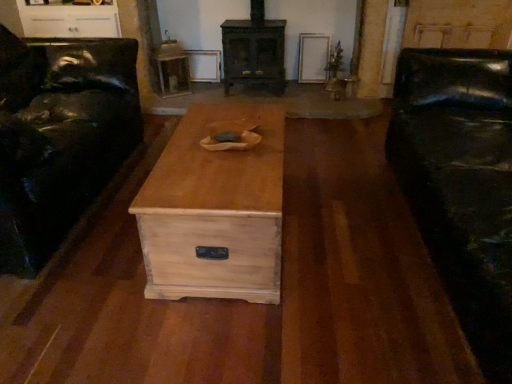
This screenshot has height=384, width=512. Describe the element at coordinates (215, 210) in the screenshot. I see `natural wood chest at center` at that location.

What do you see at coordinates (254, 51) in the screenshot?
I see `dark brown wood fireplace at center` at bounding box center [254, 51].

At what (x,y) coordinates should I click in order to perform the action: click on black leather couch at right. Please return your answer as a coordinate pair (x, y). This screenshot has width=512, height=384. Looking at the image, I should click on (461, 183).

Identify the location of natural wood chest at center. click(215, 210).

Between point (129, 58) and point (257, 211), which one is positioned behind?

Point (129, 58)

Which of these two, matte black leather couch at left or natural wood chest at center, is thinner?

natural wood chest at center.

In the image, is matte black leather couch at left positioned in front of or behind natural wood chest at center?

Visually, matte black leather couch at left is located in front of natural wood chest at center.

Between point (234, 42) and point (478, 69), which one is positioned behind?

Positioned behind is point (234, 42).

From the image's perspective, does dark brown wood fireplace at center appear higher than black leather couch at right?

Yes.

Can we say dark brown wood fireplace at center lies outside black leather couch at right?

Yes, dark brown wood fireplace at center is not within black leather couch at right.

Does dark brown wood fireplace at center come behind black leather couch at right?

Yes.

Who is bigger, wooden side table at upper center or natural wood chest at center?

natural wood chest at center is bigger.

Can you confirm if wooden side table at upper center is shorter than natural wood chest at center?

Incorrect, the height of wooden side table at upper center does not fall short of that of natural wood chest at center.

Would you say wooden side table at upper center is a long distance from natural wood chest at center?

wooden side table at upper center is far away from natural wood chest at center.

Which is more to the left, wooden side table at upper center or natural wood chest at center?

From the viewer's perspective, wooden side table at upper center appears more on the left side.

Considering the positions of objects wooden side table at upper center and dark brown wood fireplace at center in the image provided, who is more to the left, wooden side table at upper center or dark brown wood fireplace at center?

Positioned to the left is wooden side table at upper center.

Looking at this image, could you tell me if wooden side table at upper center is turned towards dark brown wood fireplace at center?

No.

At what (x,y) coordinates should I click in order to perform the action: click on side table on the left of dark brown wood fireplace at center. Please return your answer as a coordinate pair (x, y). The image size is (512, 384). Looking at the image, I should click on (172, 69).

From a real-world perspective, which is physically above, wooden side table at upper center or dark brown wood fireplace at center?

In real-world perspective, dark brown wood fireplace at center is above.

Is the position of dark brown wood fireplace at center more distant than that of wooden side table at upper center?

That is False.

From the picture: Would you consider dark brown wood fireplace at center to be distant from wooden side table at upper center?

No.

Between dark brown wood fireplace at center and wooden side table at upper center, which one has larger width?

dark brown wood fireplace at center is wider.

Considering the positions of point (226, 74) and point (169, 59), is point (226, 74) closer or farther from the camera than point (169, 59)?

Point (226, 74) is positioned closer to the camera compared to point (169, 59).

Measure the distance between matte black leather couch at left and dark brown wood fireplace at center.

matte black leather couch at left is 4.79 feet away from dark brown wood fireplace at center.

From the image's perspective, is matte black leather couch at left located above or below dark brown wood fireplace at center?

From the image's perspective, matte black leather couch at left appears below dark brown wood fireplace at center.

Between matte black leather couch at left and dark brown wood fireplace at center, which one has smaller size?

Smaller between the two is dark brown wood fireplace at center.

Which object is further away from the camera taking this photo, matte black leather couch at left or dark brown wood fireplace at center?

dark brown wood fireplace at center.

Is natural wood chest at center not close to matte black leather couch at left?

That's not correct — natural wood chest at center is a little close to matte black leather couch at left.

Which object is further away from the camera taking this photo, natural wood chest at center or matte black leather couch at left?

natural wood chest at center.

Who is shorter, natural wood chest at center or matte black leather couch at left?

natural wood chest at center is shorter.

Is point (177, 191) closer or farther from the camera than point (125, 141)?

Point (177, 191) appears to be closer to the viewer than point (125, 141).

Locate an element on the screen. The height and width of the screenshot is (384, 512). chest of drawers behind the matte black leather couch at left is located at coordinates (215, 210).

What are the coordinates of `studio couch below the dark brown wood fireplace at center (from the image's perspective)` in the screenshot? It's located at (461, 183).

When comparing their distances from natural wood chest at center, does dark brown wood fireplace at center or wooden side table at upper center seem further?

Among the two, wooden side table at upper center is located further to natural wood chest at center.

Based on their spatial positions, is black leather couch at right or dark brown wood fireplace at center closer to matte black leather couch at left?

dark brown wood fireplace at center.

Considering their positions, is black leather couch at right positioned further to wooden side table at upper center than matte black leather couch at left?

black leather couch at right lies further to wooden side table at upper center than the other object.

Which object lies further to the anchor point matte black leather couch at left, black leather couch at right or wooden side table at upper center?

black leather couch at right lies further to matte black leather couch at left than the other object.

Estimate the real-world distances between objects in this image. Which object is further from natural wood chest at center, wooden side table at upper center or dark brown wood fireplace at center?

wooden side table at upper center is further to natural wood chest at center.

When comparing their distances from wooden side table at upper center, does dark brown wood fireplace at center or black leather couch at right seem further?

black leather couch at right is further to wooden side table at upper center.

Consider the image. When comparing their distances from wooden side table at upper center, does dark brown wood fireplace at center or matte black leather couch at left seem closer?

dark brown wood fireplace at center lies closer to wooden side table at upper center than the other object.

When comparing their distances from black leather couch at right, does wooden side table at upper center or dark brown wood fireplace at center seem closer?

dark brown wood fireplace at center lies closer to black leather couch at right than the other object.

Where is `chest of drawers between black leather couch at right and dark brown wood fireplace at center in the front-back direction`? Image resolution: width=512 pixels, height=384 pixels. chest of drawers between black leather couch at right and dark brown wood fireplace at center in the front-back direction is located at coordinates (215, 210).

I want to click on fireplace located between natural wood chest at center and wooden side table at upper center in the depth direction, so click(x=254, y=51).

Identify the location of chest of drawers between matte black leather couch at left and wooden side table at upper center from front to back. The height and width of the screenshot is (384, 512). (215, 210).

Locate an element on the screen. furniture between black leather couch at right and wooden side table at upper center in the front-back direction is located at coordinates (60, 137).